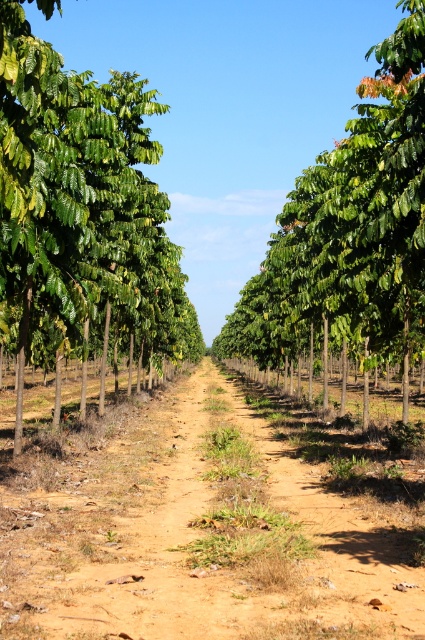
You are a gardener who needs to plant a new tree in the brown sandy soil at center. Considering the height of the green leafy tree at center, will the new tree have enough space to grow taller than the existing tree?

The brown sandy soil at center is not as tall as the green leafy tree at center, so the new tree planted there may not have enough vertical space to grow taller than the existing tree.